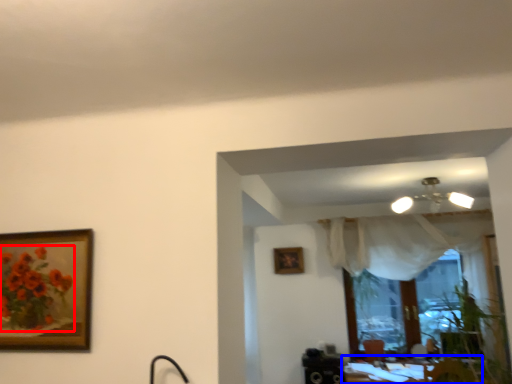
Question: Among these objects, which one is nearest to the camera, flower (highlighted by a red box) or table (highlighted by a blue box)?

Choices:
 (A) flower
 (B) table

Answer: (A)